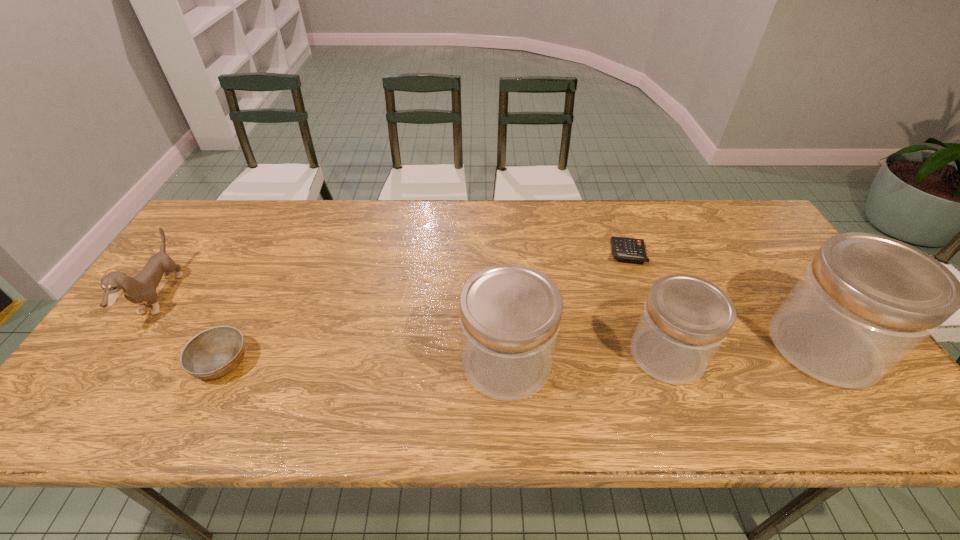
All jars are currently evenly spaced. To continue this pattern, where would you add another jar on the left? Please point out a vacant spot. Please provide its 2D coordinates. Your answer should be formatted as a tuple, i.e. [(x, y)], where the tuple contains the x and y coordinates of a point satisfying the conditions above.

[(341, 371)]